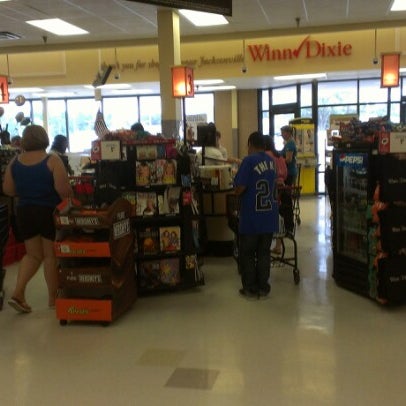
At what (x,y) coordinates should I click in order to perform the action: click on papertowels. Please return your answer as a coordinate pair (x, y). The image size is (406, 406). Looking at the image, I should click on (222, 170).